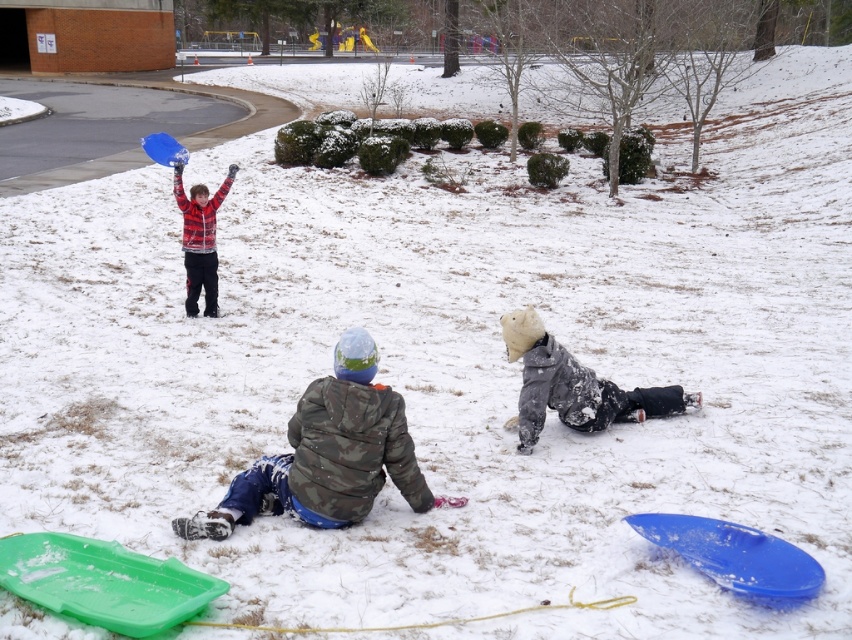
Question: Which of the following is the closest to the observer?

Choices:
 (A) camo jacket at lower center
 (B) plaid flannel shirt at upper left

Answer: (A)

Question: Which point is farther to the camera?

Choices:
 (A) camo jacket at lower center
 (B) plaid flannel shirt at upper left
 (C) snow-covered winter coat at lower right

Answer: (B)

Question: Can you confirm if camo jacket at lower center is smaller than plaid flannel shirt at upper left?

Choices:
 (A) yes
 (B) no

Answer: (B)

Question: Is snow-covered winter coat at lower right thinner than plaid flannel shirt at upper left?

Choices:
 (A) no
 (B) yes

Answer: (A)

Question: Which object appears farthest from the camera in this image?

Choices:
 (A) plaid flannel shirt at upper left
 (B) snow-covered winter coat at lower right

Answer: (A)

Question: Is camo jacket at lower center in front of snow-covered winter coat at lower right?

Choices:
 (A) no
 (B) yes

Answer: (B)